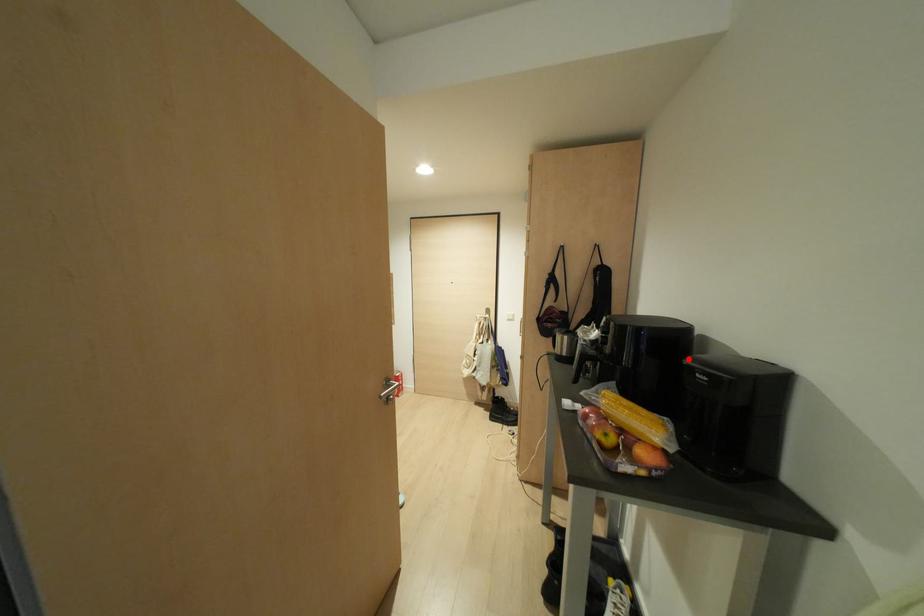
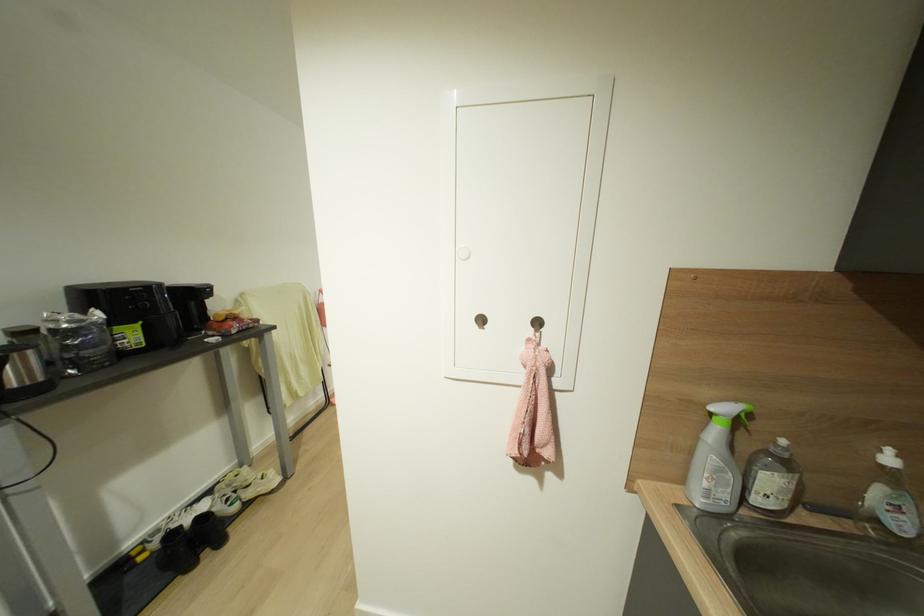
Question: I am providing you with two images of the same scene from different viewpoints. A red point is marked on the first image. Can you still see the location of the red point in image 2?

Choices:
 (A) Yes
 (B) No

Answer: (B)